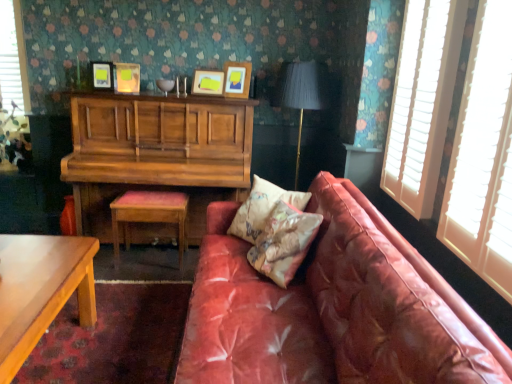
The width and height of the screenshot is (512, 384). I want to click on matte wooden picture frame at upper center, placed as the 2th picture frame when sorted from right to left, so click(x=208, y=82).

In order to face wooden picture frame at upper center, the first picture frame when ordered from right to left, should I rotate leftwards or rightwards?

Turn left by 1.974 degrees to look at wooden picture frame at upper center, the first picture frame when ordered from right to left.

The image size is (512, 384). What do you see at coordinates (40, 290) in the screenshot? I see `smooth wooden table at lower left` at bounding box center [40, 290].

Find the location of a particular element. This screenshot has width=512, height=384. smooth wooden table at lower left is located at coordinates (40, 290).

Image resolution: width=512 pixels, height=384 pixels. Identify the location of wooden stool at lower left. (149, 215).

Where is `matte wooden picture frame at upper center, marked as the 3th picture frame in a left-to-right arrangement`? The image size is (512, 384). matte wooden picture frame at upper center, marked as the 3th picture frame in a left-to-right arrangement is located at coordinates (208, 82).

How much distance is there between floral fabric pillow at center, positioned as the first pillow in front-to-back order, and white wooden blinds at right?

floral fabric pillow at center, positioned as the first pillow in front-to-back order, is 30.39 inches away from white wooden blinds at right.

From the image's perspective, relative to white wooden blinds at right, is floral fabric pillow at center, positioned as the first pillow in front-to-back order, above or below?

Based on their image positions, floral fabric pillow at center, positioned as the first pillow in front-to-back order, is located beneath white wooden blinds at right.

Is floral fabric pillow at center, positioned as the first pillow in front-to-back order, oriented away from white wooden blinds at right?

floral fabric pillow at center, positioned as the first pillow in front-to-back order, is not turned away from white wooden blinds at right.

Which object is further away from the camera taking this photo, floral fabric pillow at center, positioned as the first pillow in front-to-back order, or white wooden blinds at right?

floral fabric pillow at center, positioned as the first pillow in front-to-back order, is further from the camera.

Is white wooden blinds at right wider than leather couch at center?

No, white wooden blinds at right is not wider than leather couch at center.

Is white wooden blinds at right with leather couch at center?

No, white wooden blinds at right is not beside leather couch at center.

Is leather couch at center surrounded by white wooden blinds at right?

No, leather couch at center is not surrounded by white wooden blinds at right.

From the image's perspective, is white wooden blinds at right beneath leather couch at center?

No.

Is matte yellow picture frame at upper center, the 2th picture frame viewed from the left, positioned far away from floral-patterned fabric pillow at center, the second pillow positioned from the front?

matte yellow picture frame at upper center, the 2th picture frame viewed from the left, is positioned a significant distance from floral-patterned fabric pillow at center, the second pillow positioned from the front.

Which of these two, matte yellow picture frame at upper center, the 2th picture frame viewed from the left, or floral-patterned fabric pillow at center, the second pillow positioned from the front, is wider?

With larger width is floral-patterned fabric pillow at center, the second pillow positioned from the front.

Considering the relative positions of matte yellow picture frame at upper center, the 2th picture frame viewed from the left, and floral-patterned fabric pillow at center, the second pillow positioned from the front, in the image provided, is matte yellow picture frame at upper center, the 2th picture frame viewed from the left, to the left or to the right of floral-patterned fabric pillow at center, the second pillow positioned from the front,?

In the image, matte yellow picture frame at upper center, the 2th picture frame viewed from the left, appears on the left side of floral-patterned fabric pillow at center, the second pillow positioned from the front.

From their relative heights in the image, would you say matte yellow picture frame at upper center, the 2th picture frame viewed from the left, is taller or shorter than floral-patterned fabric pillow at center, the second pillow positioned from the front?

Considering their sizes, matte yellow picture frame at upper center, the 2th picture frame viewed from the left, has less height than floral-patterned fabric pillow at center, the second pillow positioned from the front.

Can you confirm if smooth wooden table at lower left is positioned to the right of matte yellow picture frame at upper center, positioned as the 4th picture frame in right-to-left order?

In fact, smooth wooden table at lower left is to the left of matte yellow picture frame at upper center, positioned as the 4th picture frame in right-to-left order.

In terms of width, does smooth wooden table at lower left look wider or thinner when compared to matte yellow picture frame at upper center, positioned as the 4th picture frame in right-to-left order?

In the image, smooth wooden table at lower left appears to be wider than matte yellow picture frame at upper center, positioned as the 4th picture frame in right-to-left order.

Considering the relative sizes of smooth wooden table at lower left and matte yellow picture frame at upper center, the first picture frame from the left, in the image provided, is smooth wooden table at lower left taller than matte yellow picture frame at upper center, the first picture frame from the left,?

Yes, smooth wooden table at lower left is taller than matte yellow picture frame at upper center, the first picture frame from the left.

Is wooden piano at upper left not within matte black lampshade at center?

Yes.

Is wooden piano at upper left thinner than matte black lampshade at center?

Incorrect, the width of wooden piano at upper left is not less than that of matte black lampshade at center.

Is point (85, 94) closer to camera compared to point (321, 85)?

No, it is behind (321, 85).

From a real-world perspective, which object rests below the other?

wooden piano at upper left.

Based on their sizes in the image, would you say matte yellow picture frame at upper center, the 3th picture frame from the right, is bigger or smaller than matte wooden picture frame at upper center, marked as the 3th picture frame in a left-to-right arrangement?

In the image, matte yellow picture frame at upper center, the 3th picture frame from the right, appears to be smaller than matte wooden picture frame at upper center, marked as the 3th picture frame in a left-to-right arrangement.

Which is behind, point (121, 70) or point (217, 89)?

The point (121, 70) is more distant.

From the image's perspective, relative to matte wooden picture frame at upper center, placed as the 2th picture frame when sorted from right to left, is matte yellow picture frame at upper center, the 3th picture frame from the right, above or below?

matte yellow picture frame at upper center, the 3th picture frame from the right, is situated higher than matte wooden picture frame at upper center, placed as the 2th picture frame when sorted from right to left, in the image.

Is matte yellow picture frame at upper center, the 3th picture frame from the right, located outside matte wooden picture frame at upper center, marked as the 3th picture frame in a left-to-right arrangement?

matte yellow picture frame at upper center, the 3th picture frame from the right, lies outside matte wooden picture frame at upper center, marked as the 3th picture frame in a left-to-right arrangement,'s area.

Would you say matte black lampshade at center is outside white wooden blinds at right?

Yes.

From the image's perspective, which is below, matte black lampshade at center or white wooden blinds at right?

matte black lampshade at center, from the image's perspective.

How distant is matte black lampshade at center from white wooden blinds at right?

matte black lampshade at center and white wooden blinds at right are 90.66 centimeters apart.

From a real-world perspective, between matte black lampshade at center and white wooden blinds at right, who is vertically higher?

In real-world perspective, white wooden blinds at right is above.

At what (x,y) coordinates should I click in order to perform the action: click on the 1st pillow positioned below the white wooden blinds at right (from a real-world perspective). Please return your answer as a coordinate pair (x, y). The height and width of the screenshot is (384, 512). Looking at the image, I should click on (284, 242).

At what (x,y) coordinates should I click in order to perform the action: click on blind behind the leather couch at center. Please return your answer as a coordinate pair (x, y). The width and height of the screenshot is (512, 384). Looking at the image, I should click on (420, 105).

Which object lies further to the anchor point matte black lampshade at center, wooden piano at upper left or smooth wooden table at lower left?

smooth wooden table at lower left lies further to matte black lampshade at center than the other object.

Considering their positions, is wooden picture frame at upper center, the first picture frame when ordered from right to left, positioned further to matte yellow picture frame at upper center, positioned as the 4th picture frame in right-to-left order, than floral-patterned fabric pillow at center, which ranks as the first pillow in back-to-front order?

The object further to matte yellow picture frame at upper center, positioned as the 4th picture frame in right-to-left order, is floral-patterned fabric pillow at center, which ranks as the first pillow in back-to-front order.

Which object lies further to the anchor point floral-patterned fabric pillow at center, the second pillow positioned from the front, white wooden blinds at right or wooden picture frame at upper center, the first picture frame when ordered from right to left?

wooden picture frame at upper center, the first picture frame when ordered from right to left.

Which object lies further to the anchor point leather couch at center, matte wooden picture frame at upper center, marked as the 3th picture frame in a left-to-right arrangement, or floral-patterned fabric pillow at center, the second pillow positioned from the front?

matte wooden picture frame at upper center, marked as the 3th picture frame in a left-to-right arrangement, is positioned further to the anchor leather couch at center.

Estimate the real-world distances between objects in this image. Which object is closer to matte yellow picture frame at upper center, the 2th picture frame viewed from the left, matte yellow picture frame at upper center, the first picture frame from the left, or wooden piano at upper left?

matte yellow picture frame at upper center, the first picture frame from the left, lies closer to matte yellow picture frame at upper center, the 2th picture frame viewed from the left, than the other object.

Considering their positions, is matte yellow picture frame at upper center, the 3th picture frame from the right, positioned closer to matte black lampshade at center than floral-patterned fabric pillow at center, which ranks as the first pillow in back-to-front order?

Among the two, floral-patterned fabric pillow at center, which ranks as the first pillow in back-to-front order, is located nearer to matte black lampshade at center.

From the image, which object appears to be farther from floral fabric pillow at center, which is the 2th pillow in back-to-front order, wooden stool at lower left or matte yellow picture frame at upper center, the 3th picture frame from the right?

Among the two, matte yellow picture frame at upper center, the 3th picture frame from the right, is located further to floral fabric pillow at center, which is the 2th pillow in back-to-front order.

Based on their spatial positions, is white wood blinds at right or wooden piano at upper left closer to floral fabric pillow at center, which is the 2th pillow in back-to-front order?

white wood blinds at right lies closer to floral fabric pillow at center, which is the 2th pillow in back-to-front order, than the other object.

Where is `cabinetry between floral fabric pillow at center, which is the 2th pillow in back-to-front order, and wooden stool at lower left, along the z-axis`? Image resolution: width=512 pixels, height=384 pixels. cabinetry between floral fabric pillow at center, which is the 2th pillow in back-to-front order, and wooden stool at lower left, along the z-axis is located at coordinates (156, 153).

Image resolution: width=512 pixels, height=384 pixels. I want to click on table positioned between leather couch at center and matte yellow picture frame at upper center, the 3th picture frame from the right, from near to far, so click(x=40, y=290).

Locate an element on the screen. The height and width of the screenshot is (384, 512). blind located between white wood blinds at right and matte black lampshade at center in the depth direction is located at coordinates (420, 105).

The height and width of the screenshot is (384, 512). In order to click on cabinetry between matte yellow picture frame at upper center, the 2th picture frame viewed from the left, and wooden picture frame at upper center, the first picture frame when ordered from right to left, in the horizontal direction in this screenshot , I will do `click(156, 153)`.